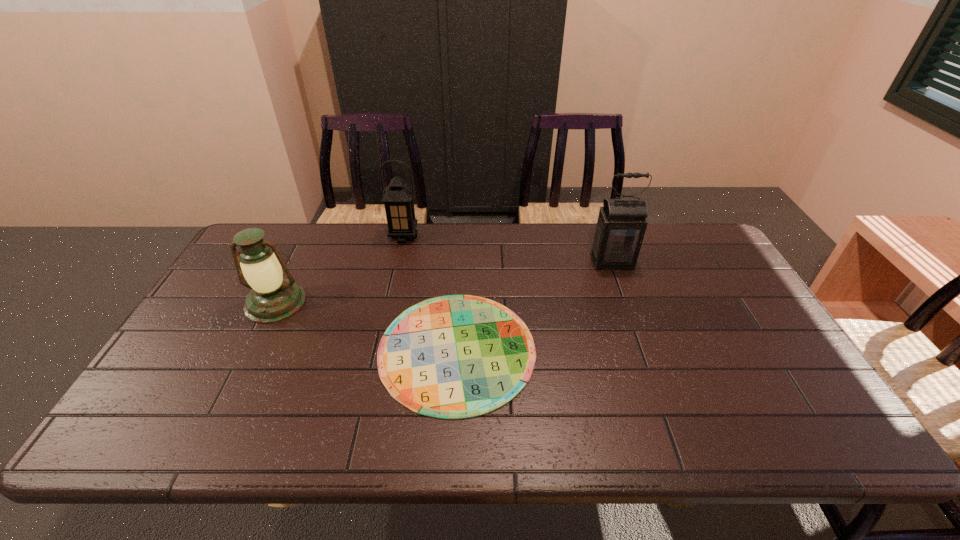
Select which lantern is the second closest to the nearest lantern. Please provide its 2D coordinates. Your answer should be formatted as a tuple, i.e. [(x, y)], where the tuple contains the x and y coordinates of a point satisfying the conditions above.

[(620, 229)]

Locate an element on the screen. Image resolution: width=960 pixels, height=540 pixels. lantern object that ranks as the second closest to the third nearest object is located at coordinates (272, 299).

This screenshot has width=960, height=540. Identify the location of vacant area that satisfies the following two spatial constraints: 1. with the light compartment facing forward on the shortest lantern; 2. on the left side of the shortest object. (252, 349).

Image resolution: width=960 pixels, height=540 pixels. Identify the location of blank area in the image that satisfies the following two spatial constraints: 1. with the light compartment facing forward on the gameboard; 2. on the left side of the leftmost object. (252, 349).

Locate an element on the screen. The width and height of the screenshot is (960, 540). free space that satisfies the following two spatial constraints: 1. on the front side of the farthest object; 2. on the left side of the shortest object is located at coordinates (378, 349).

The image size is (960, 540). I want to click on free spot that satisfies the following two spatial constraints: 1. with the light compartment facing forward on the leftmost object; 2. on the left side of the gameboard, so click(252, 349).

The width and height of the screenshot is (960, 540). I want to click on free location that satisfies the following two spatial constraints: 1. with the light compartment facing forward on the second shortest object; 2. on the right side of the shortest object, so click(252, 349).